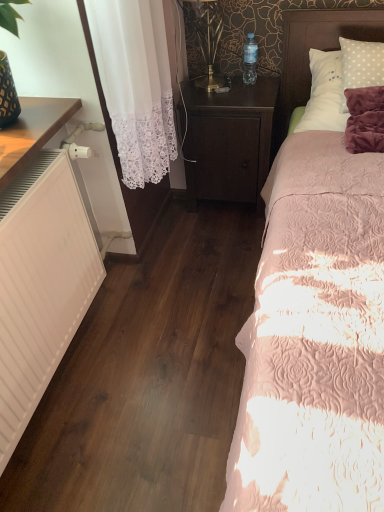
At what (x,y) coordinates should I click in order to perform the action: click on vacant space to the left of transparent plastic bottle at upper center. Please return your answer as a coordinate pair (x, y). Looking at the image, I should click on (208, 83).